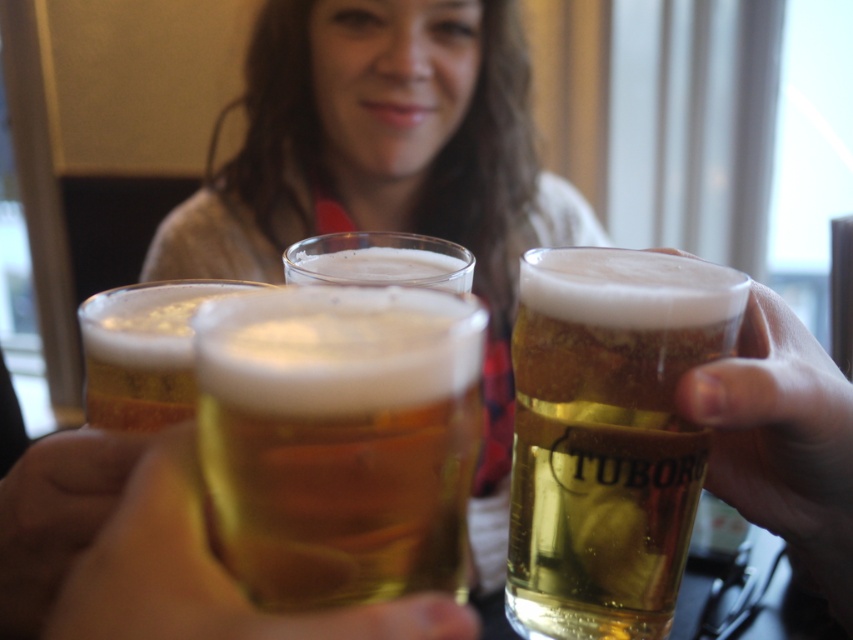
Question: Does translucent glass at center appear under golden glass beer at center?

Choices:
 (A) yes
 (B) no

Answer: (A)

Question: Estimate the real-world distances between objects in this image. Which object is closer to the translucent glass mug at right?

Choices:
 (A) golden glass beer at center
 (B) golden glass mug at center
 (C) translucent glass mug at center

Answer: (C)

Question: Which object appears farthest from the camera in this image?

Choices:
 (A) translucent glass mug at right
 (B) translucent glass at center
 (C) golden glass mug at center

Answer: (A)

Question: Is translucent glass at center below golden glass beer at center?

Choices:
 (A) no
 (B) yes

Answer: (B)

Question: Does translucent glass at center appear on the left side of golden glass beer at center?

Choices:
 (A) yes
 (B) no

Answer: (B)

Question: Which of the following is the farthest from the observer?

Choices:
 (A) translucent glass at center
 (B) golden glass mug at center

Answer: (B)